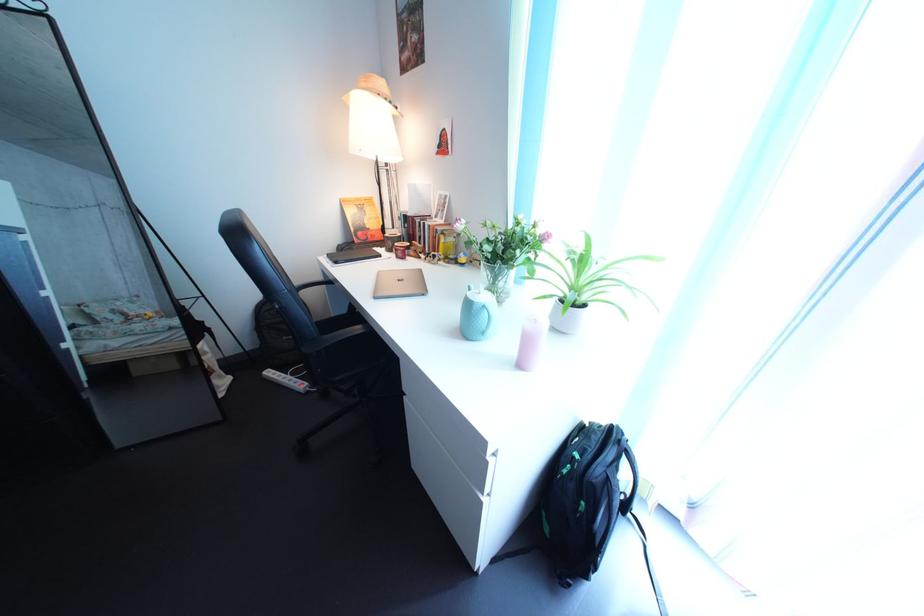
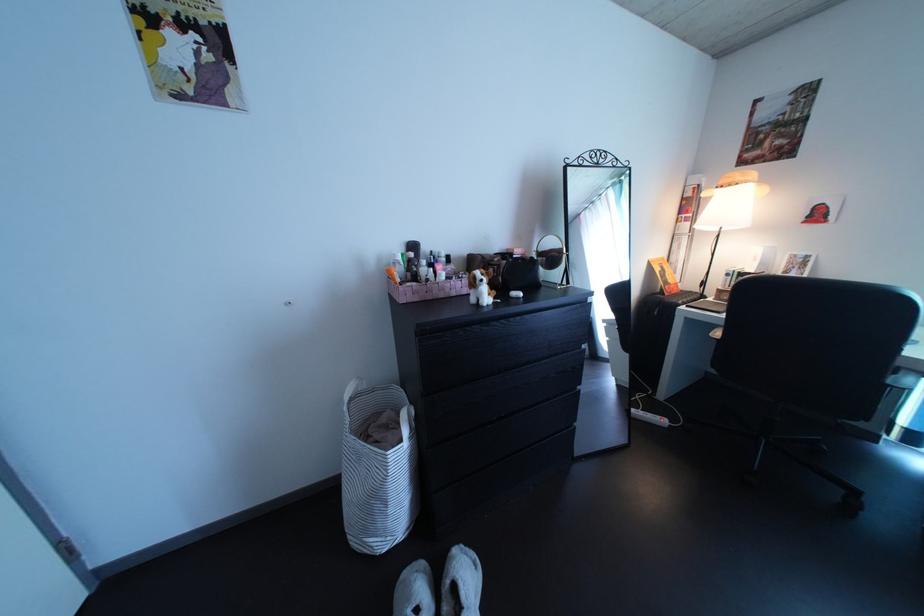
Question: Which direction would the cameraman need to move to produce the second image? Reply with the corresponding letter.

Choices:
 (A) Left
 (B) Right
 (C) Forward
 (D) Backward

Answer: (A)